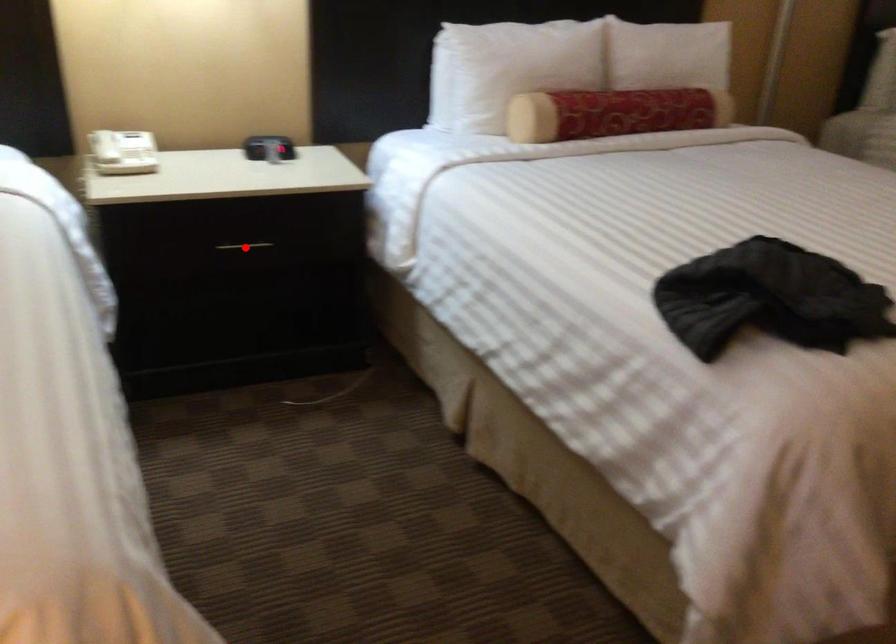
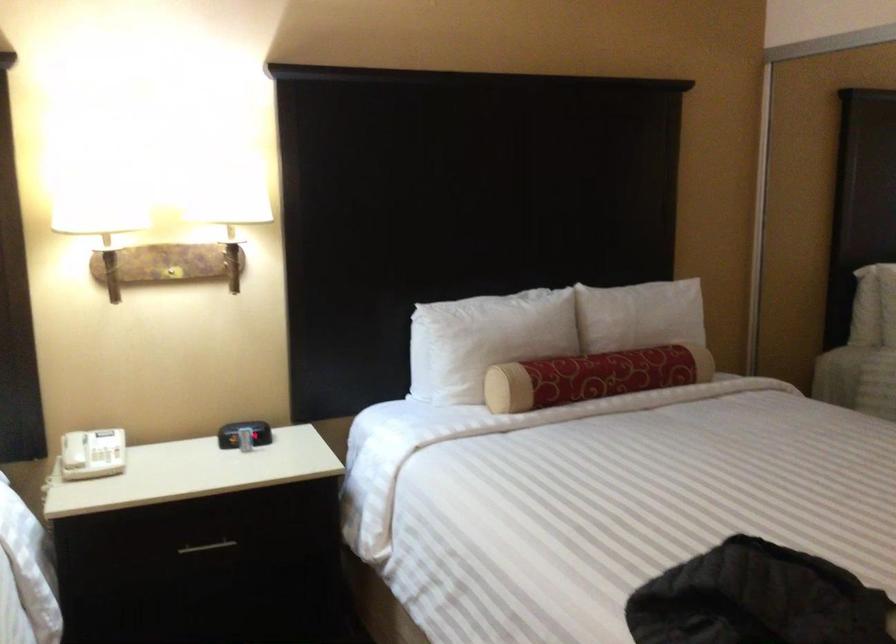
Find the pixel in the second image that matches the highlighted location in the first image.

(207, 547)